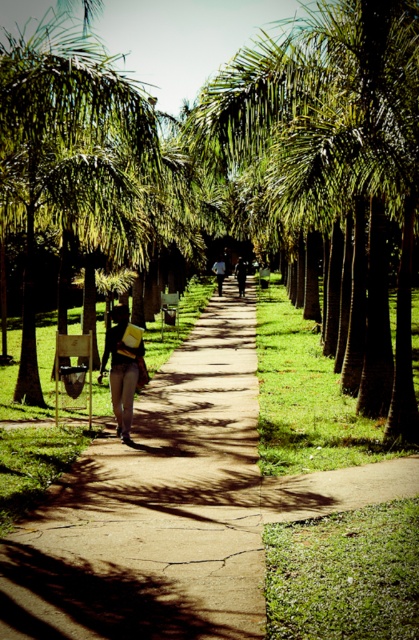
You are standing at the end of the pathway and want to take a photo of the green leafy palm at center. If your camera has a maximum zoom range of 20 feet, will you be able to capture the palm clearly without moving closer?

The green leafy palm at center is 21.57 feet away from the camera. Since the camera can only zoom up to 20 feet, you will not be able to capture the palm clearly without moving closer.